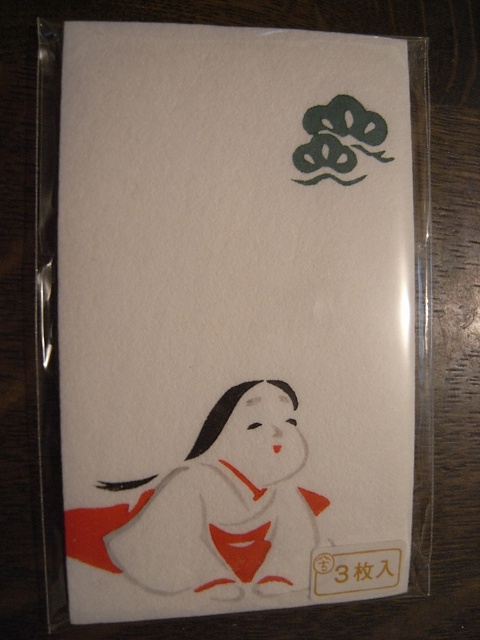
You are designing a layout for a greeting card and need to place two elements on it. You have a white paper at center and a matte white kimono at lower left. According to the image, which element should you place first if you want to follow the standard reading direction from left to right?

The matte white kimono at lower left should be placed first because it is positioned to the left of the white paper at center, following the left to right reading direction.

Where is the white paper at center located in the image?

The white paper at center is located at point coordinates of (x=233, y=317).

From the picture: You are designing a layout for a greeting card and need to place both the white paper at center and the matte white kimono at lower left. Given their sizes, which object should you prioritize placing first to ensure proper alignment?

The white paper at center should be prioritized since it is larger than the matte white kimono at lower left, ensuring there is enough space for it first.